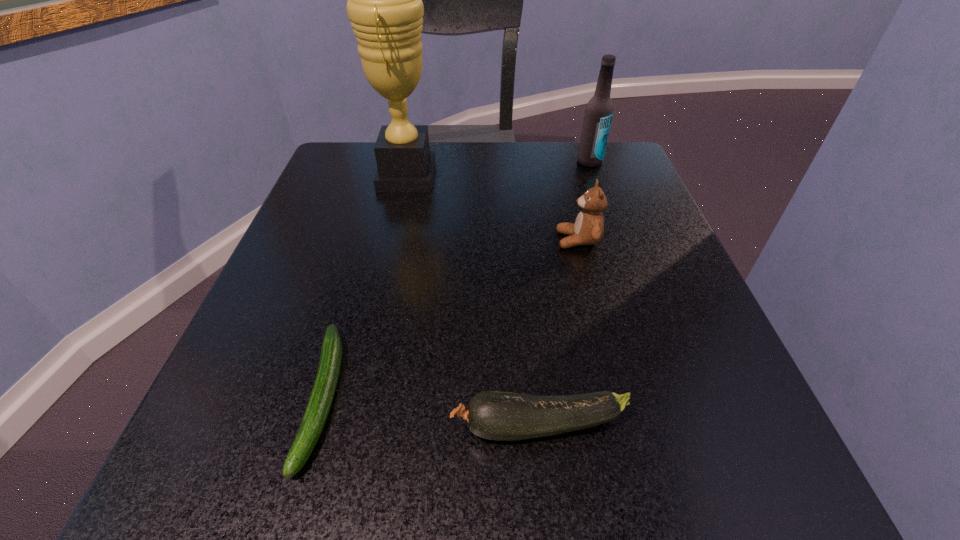
Locate an element on the screen. This screenshot has width=960, height=540. free space between the second shortest object and the third shortest object is located at coordinates (559, 333).

Locate an element on the screen. vacant point located between the shortest object and the fourth tallest object is located at coordinates [x=431, y=412].

This screenshot has height=540, width=960. I want to click on blank region between the beer bottle and the tallest object, so click(498, 169).

Locate an element on the screen. The width and height of the screenshot is (960, 540). the second closest object relative to the teddy bear is located at coordinates tap(385, 7).

This screenshot has width=960, height=540. In order to click on object that is the second closest one to the tallest object in this screenshot , I will do `click(599, 110)`.

This screenshot has height=540, width=960. What are the coordinates of `free location that satisfies the following two spatial constraints: 1. on the side of the beer bottle with the label; 2. at the blossom end of the right zucchini` in the screenshot? It's located at (684, 426).

Find the location of `vacant space that satisfies the following two spatial constraints: 1. on the side of the second tallest object with the label; 2. on the front-facing side of the teddy bear`. vacant space that satisfies the following two spatial constraints: 1. on the side of the second tallest object with the label; 2. on the front-facing side of the teddy bear is located at coordinates (617, 240).

Where is `vacant point that satisfies the following two spatial constraints: 1. on the side of the rightmost object with the label; 2. at the front of the tallest object with handles`? vacant point that satisfies the following two spatial constraints: 1. on the side of the rightmost object with the label; 2. at the front of the tallest object with handles is located at coordinates (595, 176).